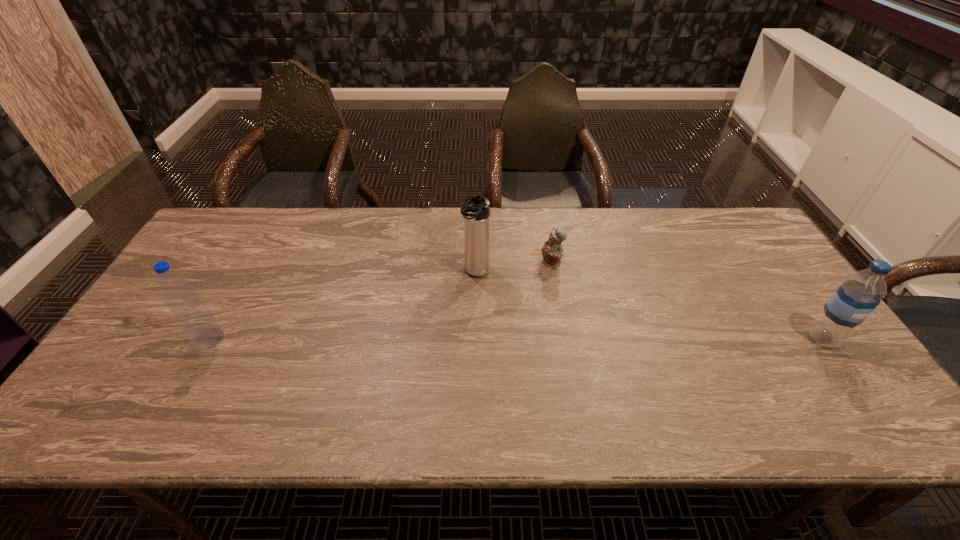
I want to click on vacant region located on the handle side of the third object from right to left, so click(x=430, y=354).

Identify the location of free space located on the handle side of the third object from right to left. (414, 380).

Identify the location of vacant space located 0.300m on the handle side of the third object from right to left. This screenshot has height=540, width=960. (422, 366).

The height and width of the screenshot is (540, 960). Identify the location of object that is at the left edge. (191, 313).

Image resolution: width=960 pixels, height=540 pixels. I want to click on object at the right edge, so click(861, 292).

The width and height of the screenshot is (960, 540). In the image, there is a desktop. Identify the location of vacant space at the far edge. (596, 240).

Find the location of `free location at the near edge`. free location at the near edge is located at coordinates (218, 382).

Where is `free space at the left edge`? free space at the left edge is located at coordinates (115, 362).

Where is `free space at the right edge of the desktop`? Image resolution: width=960 pixels, height=540 pixels. free space at the right edge of the desktop is located at coordinates (825, 354).

Where is `free region at the far left corner`? free region at the far left corner is located at coordinates (231, 234).